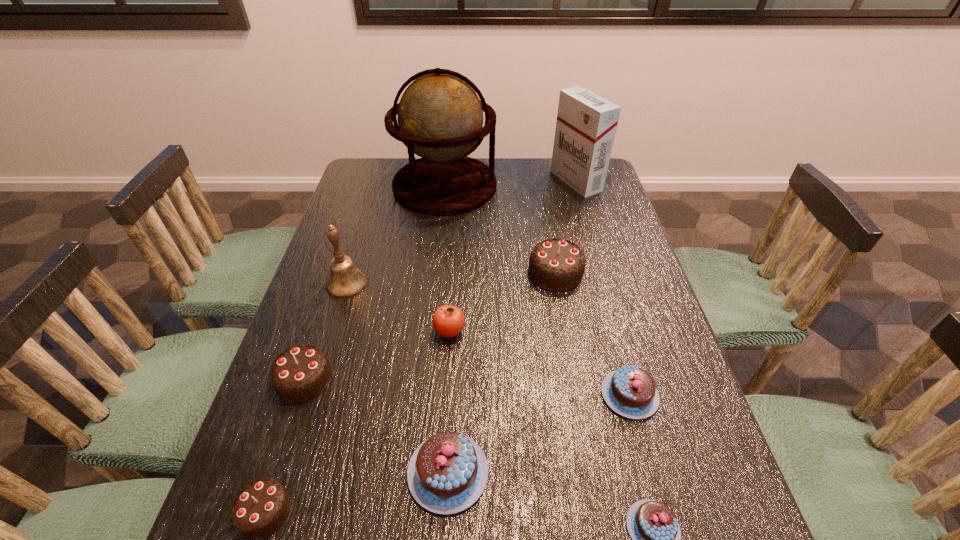
At what (x,y) coordinates should I click in order to perform the action: click on globe that is positioned at the far edge. Please return your answer as a coordinate pair (x, y). The width and height of the screenshot is (960, 540). Looking at the image, I should click on (440, 117).

Identify the location of cigarette case present at the far edge. The width and height of the screenshot is (960, 540). (586, 124).

The width and height of the screenshot is (960, 540). What are the coordinates of `object located in the near edge section of the desktop` in the screenshot? It's located at (260, 508).

Find the location of `globe positioned at the left edge`. globe positioned at the left edge is located at coordinates (440, 117).

The height and width of the screenshot is (540, 960). I want to click on bell at the left edge, so click(345, 280).

Where is `cigarette case that is at the right edge`? The height and width of the screenshot is (540, 960). cigarette case that is at the right edge is located at coordinates (586, 124).

Find the location of a particular element. This screenshot has width=960, height=540. chocolate cake that is at the right edge is located at coordinates (630, 391).

The height and width of the screenshot is (540, 960). In order to click on object that is at the far left corner in this screenshot , I will do `click(440, 117)`.

I want to click on object at the near left corner, so click(260, 508).

Identify the location of object located at the far right corner. The image size is (960, 540). (586, 124).